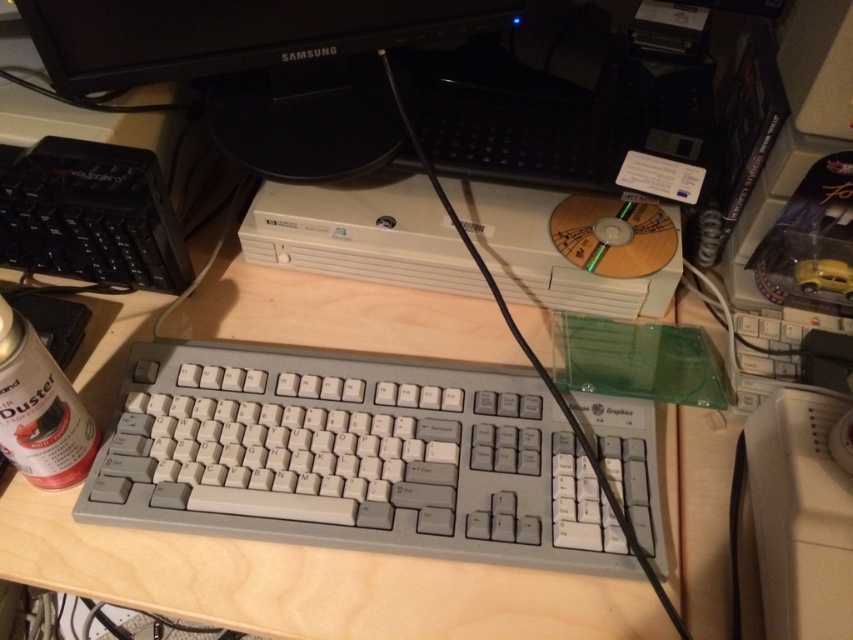
Question: Can you confirm if gray plastic keyboard at center is thinner than black glossy monitor at upper center?

Choices:
 (A) no
 (B) yes

Answer: (A)

Question: Which point is farther to the camera?

Choices:
 (A) gray plastic keyboard at center
 (B) black glossy monitor at upper center

Answer: (B)

Question: Is the position of gray plastic keyboard at center more distant than that of black glossy monitor at upper center?

Choices:
 (A) no
 (B) yes

Answer: (A)

Question: Can you confirm if gray plastic keyboard at center is positioned to the right of black glossy monitor at upper center?

Choices:
 (A) yes
 (B) no

Answer: (A)